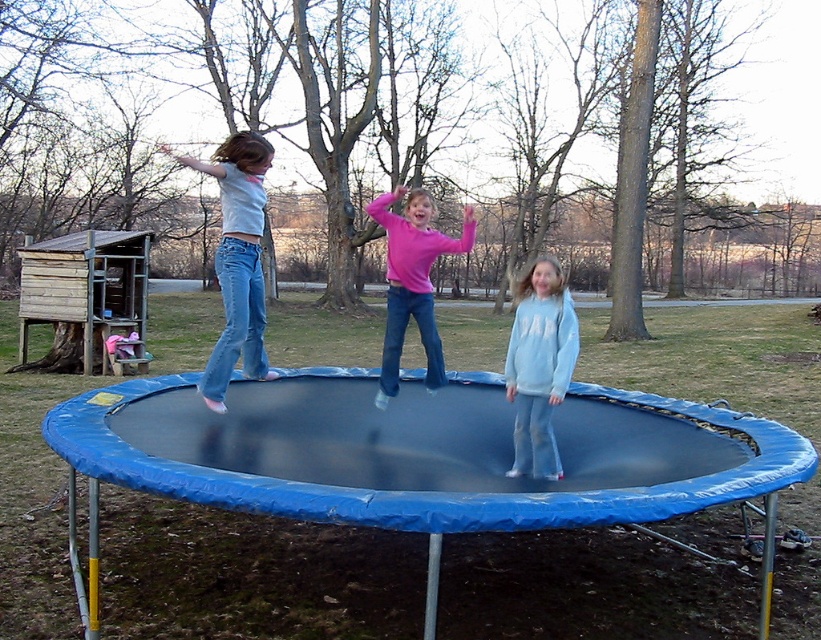
Question: Considering the real-world distances, which object is closest to the light blue denim jeans at left?

Choices:
 (A) blue rubber trampoline at center
 (B) light blue fleece sweatshirt at center

Answer: (B)

Question: Estimate the real-world distances between objects in this image. Which object is farther from the light blue fleece sweatshirt at center?

Choices:
 (A) blue rubber trampoline at center
 (B) light blue denim jeans at left

Answer: (B)

Question: Which object appears closest to the camera in this image?

Choices:
 (A) blue rubber trampoline at center
 (B) light blue denim jeans at left
 (C) light blue fleece sweatshirt at center

Answer: (A)

Question: Can you confirm if blue rubber trampoline at center is smaller than light blue fleece sweatshirt at center?

Choices:
 (A) no
 (B) yes

Answer: (A)

Question: From the image, what is the correct spatial relationship of light blue denim jeans at left in relation to light blue fleece sweatshirt at center?

Choices:
 (A) above
 (B) below

Answer: (A)

Question: Does blue rubber trampoline at center appear under light blue fleece sweatshirt at center?

Choices:
 (A) yes
 (B) no

Answer: (A)